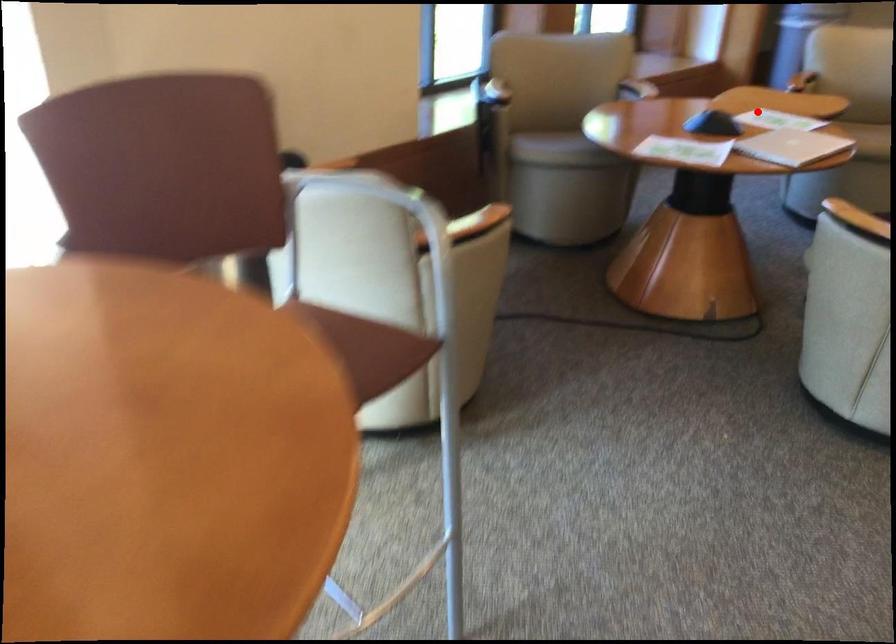
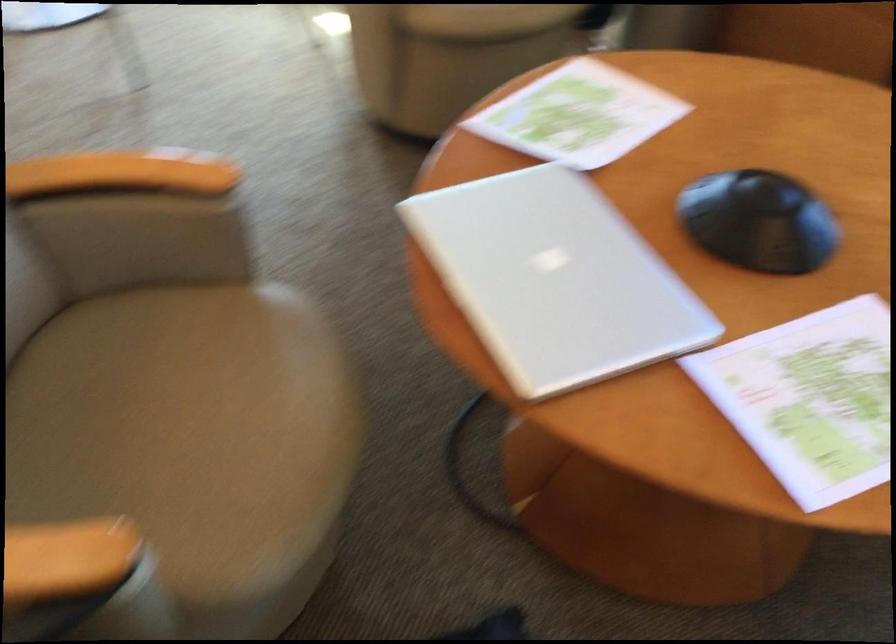
Where in the second image is the point corresponding to the highlighted location from the first image?

(810, 399)